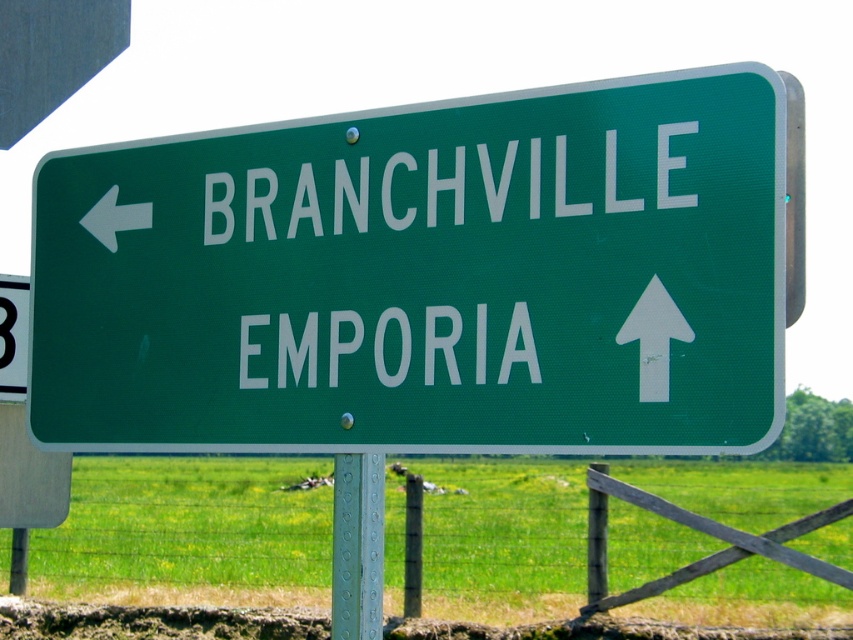
Who is taller, wooden at center or white matte arrow at left?

Standing taller between the two is wooden at center.

Is point (294, 528) more distant than point (96, 211)?

Yes, it is behind point (96, 211).

Where is `wooden at center`? This screenshot has height=640, width=853. wooden at center is located at coordinates (187, 525).

Between green matte sign at center and white matte arrow at left, which one appears on the right side from the viewer's perspective?

green matte sign at center

Is green matte sign at center thinner than white matte arrow at left?

Incorrect, green matte sign at center's width is not less than white matte arrow at left's.

Describe the element at coordinates (422, 276) in the screenshot. I see `green matte sign at center` at that location.

This screenshot has width=853, height=640. I want to click on green matte sign at center, so click(x=422, y=276).

Who is lower down, wooden at center or metallic gray pole at center?

wooden at center is lower down.

Who is more forward, (756, 531) or (380, 532)?

Point (380, 532) is in front.

The image size is (853, 640). What are the coordinates of `wooden at center` in the screenshot? It's located at (187, 525).